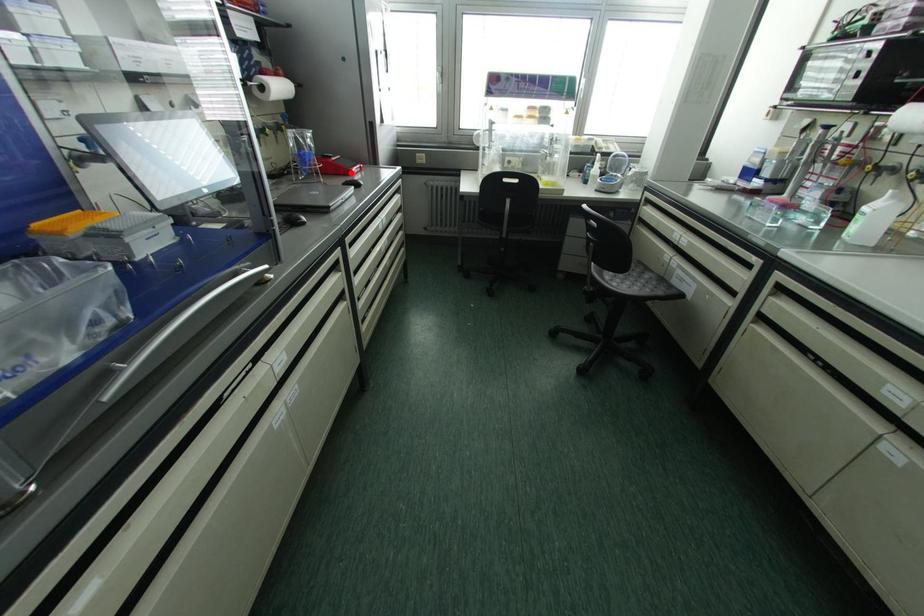
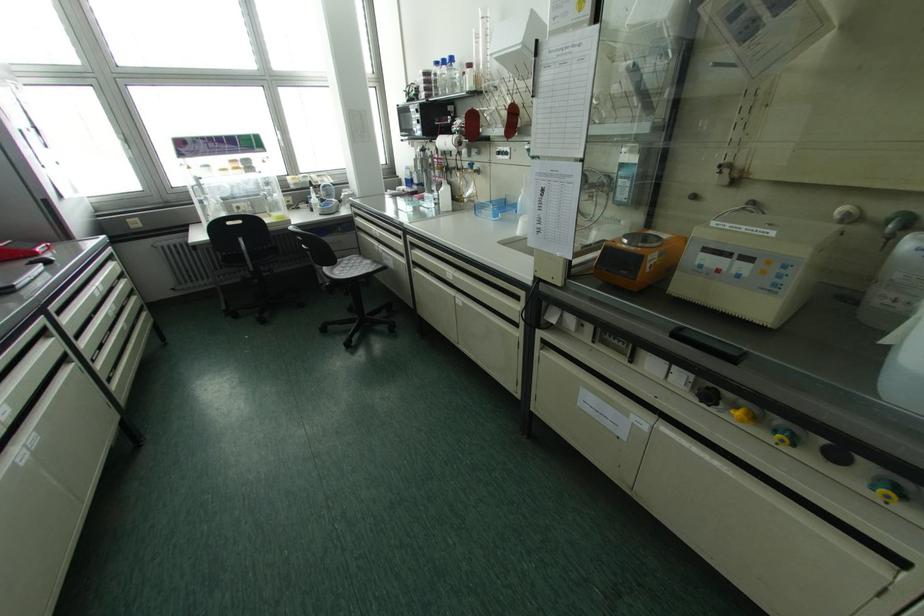
In the second image, find the point that corresponds to the highlighted location in the first image.

(35, 254)